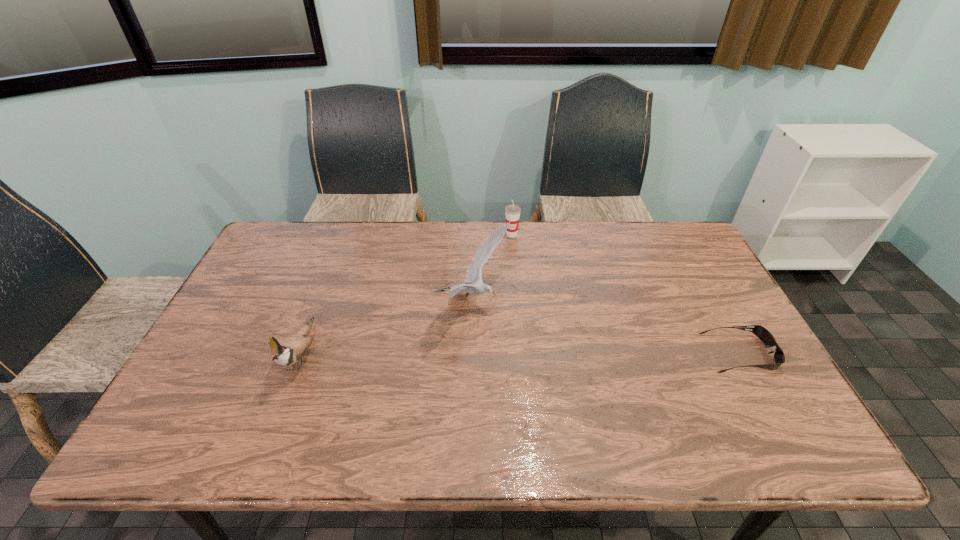
The height and width of the screenshot is (540, 960). Find the location of `free space at the far right corner of the desktop`. free space at the far right corner of the desktop is located at coordinates (683, 228).

You are a GUI agent. You are given a task and a screenshot of the screen. Output one action in this format:
    pyautogui.click(x=<x>, y=<y>)
    Task: Click on the free point at the near right corner
    The height and width of the screenshot is (540, 960).
    Given the screenshot: What is the action you would take?
    pyautogui.click(x=735, y=400)

Find the location of a particular element. empty location between the gull and the second shortest object is located at coordinates (492, 269).

Find the location of a particular element. The height and width of the screenshot is (540, 960). free space between the gull and the second shortest object is located at coordinates (492, 269).

Locate an element on the screen. The image size is (960, 540). unoccupied area between the cup and the gull is located at coordinates (492, 269).

Where is `empty space between the third tallest object and the leftmost object`? The height and width of the screenshot is (540, 960). empty space between the third tallest object and the leftmost object is located at coordinates (407, 294).

You are a GUI agent. You are given a task and a screenshot of the screen. Output one action in this format:
    pyautogui.click(x=<x>, y=<y>)
    Task: Click on the free point between the sunglasses and the gull
    
    Given the screenshot: What is the action you would take?
    pyautogui.click(x=607, y=329)

At what (x,y) coordinates should I click in order to perform the action: click on free space between the second shortest object and the gull. Please return your answer as a coordinate pair (x, y). This screenshot has width=960, height=540. Looking at the image, I should click on (492, 269).

Where is `vacant point located between the cup and the gull`? The height and width of the screenshot is (540, 960). vacant point located between the cup and the gull is located at coordinates click(x=492, y=269).

This screenshot has width=960, height=540. Identify the location of free space that is in between the leftmost object and the shortest object. (520, 354).